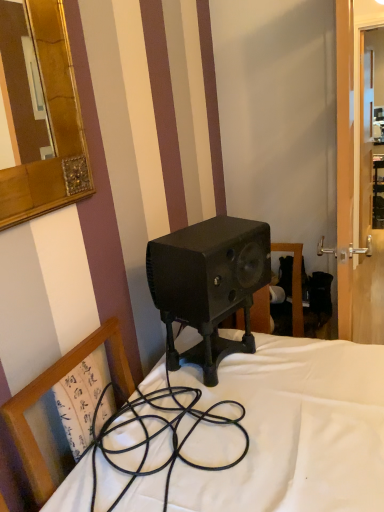
Question: From a real-world perspective, relative to matte black speaker at center, is transparent glass door at right vertically above or below?

Choices:
 (A) below
 (B) above

Answer: (B)

Question: Choose the correct answer: Is transparent glass door at right inside matte black speaker at center or outside it?

Choices:
 (A) inside
 (B) outside

Answer: (B)

Question: Which of these objects is positioned farthest from the transparent glass door at right?

Choices:
 (A) matte black speaker at center
 (B) wooden chair at center

Answer: (B)

Question: Based on their relative distances, which object is nearer to the wooden chair at center?

Choices:
 (A) transparent glass door at right
 (B) matte black speaker at center

Answer: (B)